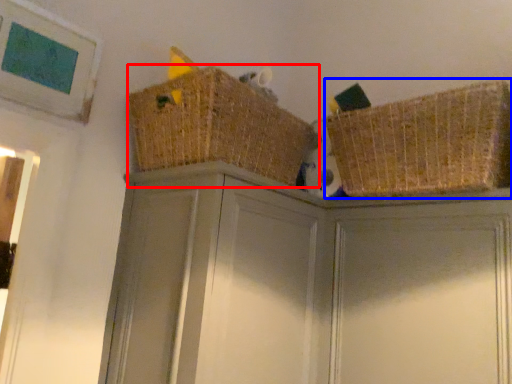
Question: Which of the following is the closest to the observer, basket (highlighted by a red box) or basket (highlighted by a blue box)?

Choices:
 (A) basket
 (B) basket

Answer: (B)